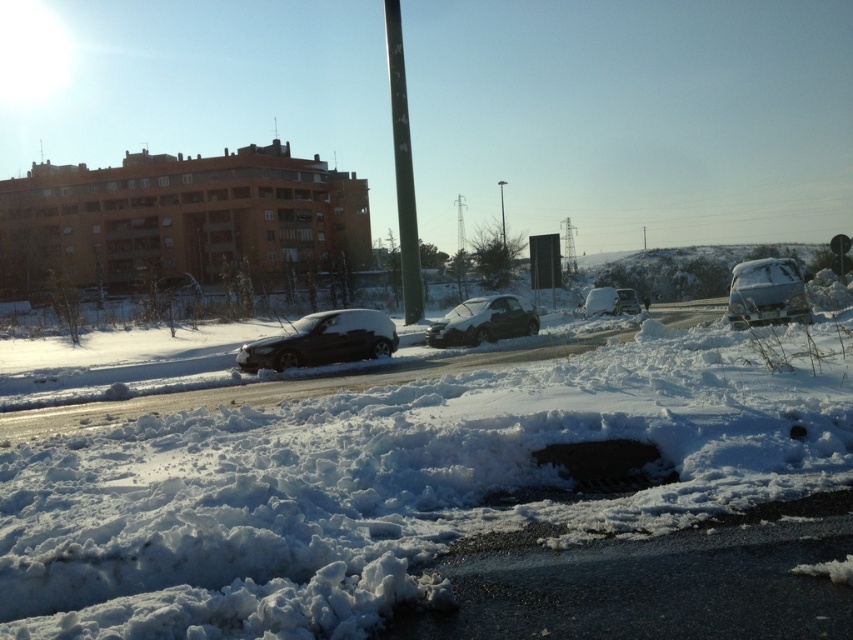
You are a delivery robot navigating a snowy road. You need to avoid getting stuck in deep snow. According to the scene, where is the white fluffy snow at center located?

The white fluffy snow at center is located at point (395, 483). To avoid getting stuck, the robot should steer clear of this area.